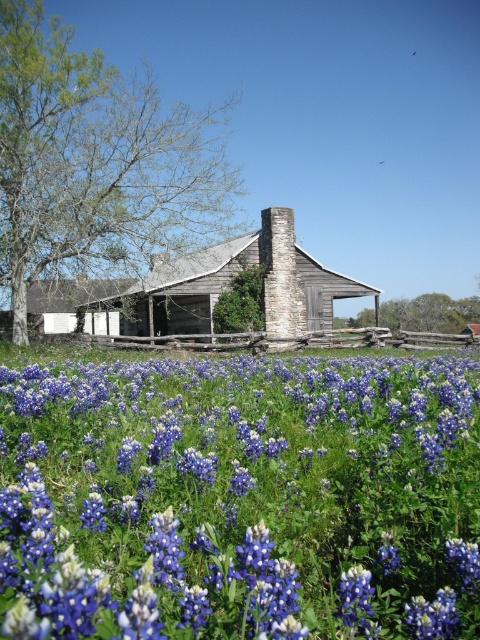
Does blue matte flower at center have a smaller size compared to weathered wood barn at center?

Indeed, blue matte flower at center has a smaller size compared to weathered wood barn at center.

Does point (373, 509) come closer to viewer compared to point (269, 248)?

Yes, it is.

Where is `blue matte flower at center`? This screenshot has height=640, width=480. blue matte flower at center is located at coordinates (241, 497).